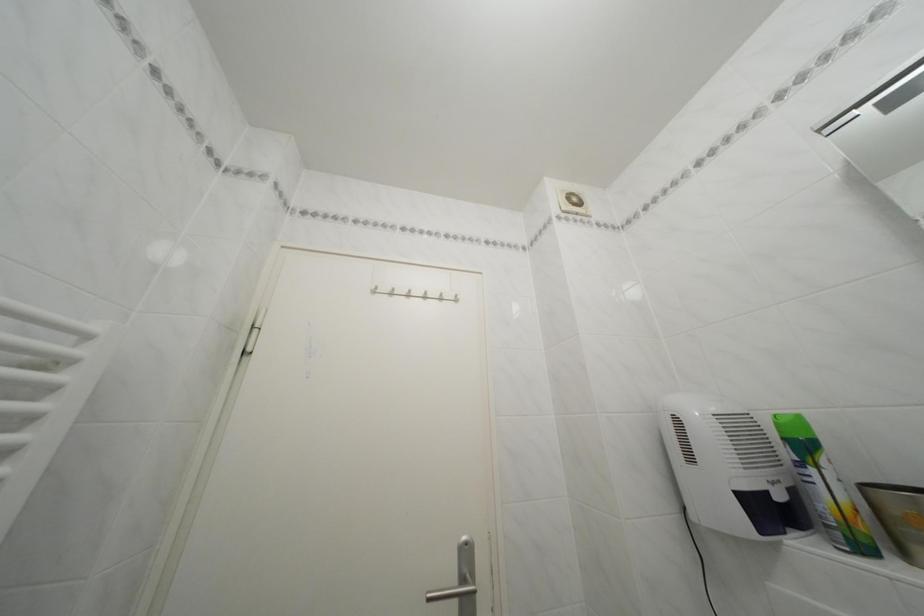
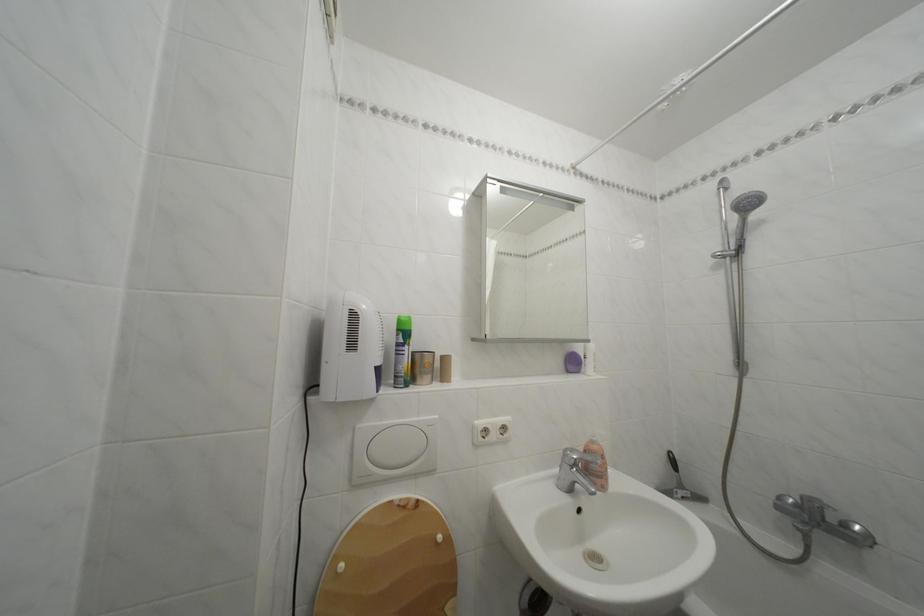
The point at (793, 445) is marked in the first image. Where is the corresponding point in the second image?

(407, 336)